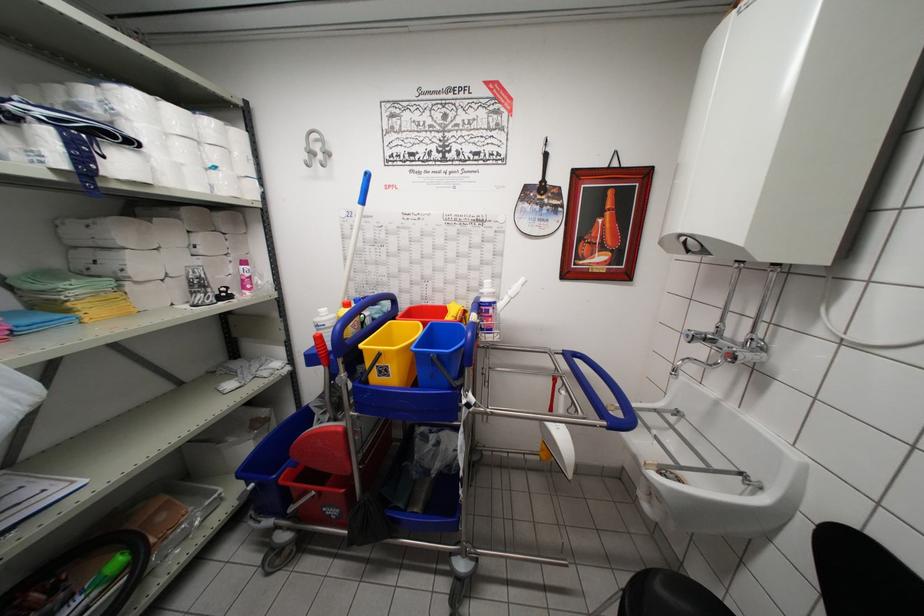
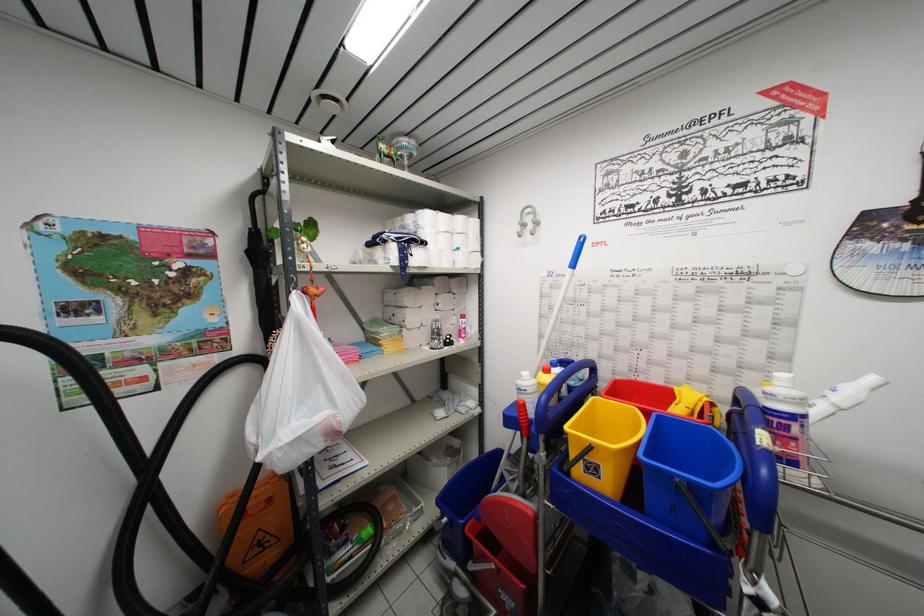
Question: The camera is either moving clockwise (left) or counter-clockwise (right) around the object. The first image is from the beginning of the video and the second image is from the end. Is the camera moving left or right when shooting the video?

Choices:
 (A) Left
 (B) Right

Answer: (B)